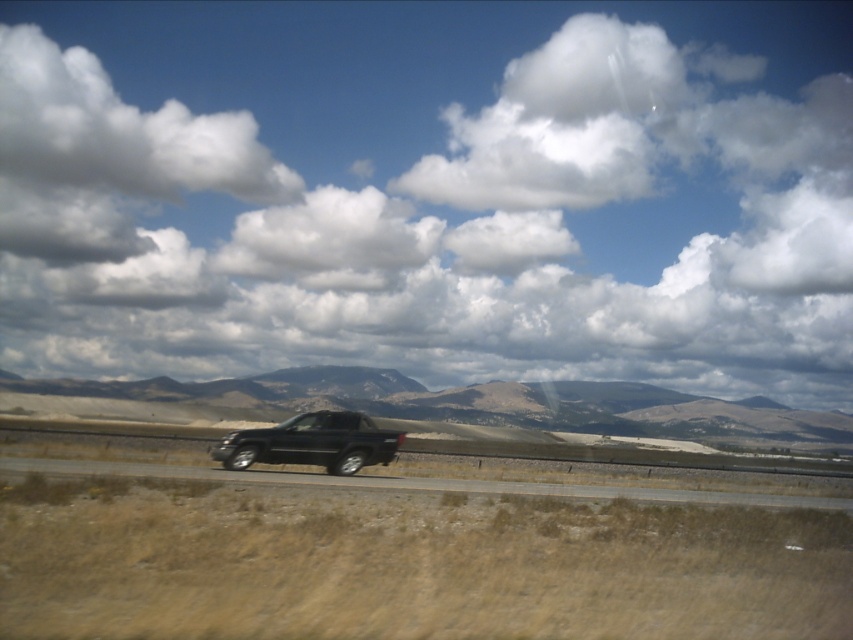
You are a photographer trying to capture the glossy black truck at center and the transparent glass window at center in the same frame. Which object should you move closer to in order to ensure both are fully visible without cropping?

The glossy black truck at center might be wider than transparent glass window at center, so you should move closer to the transparent glass window at center to ensure both are fully visible without cropping.